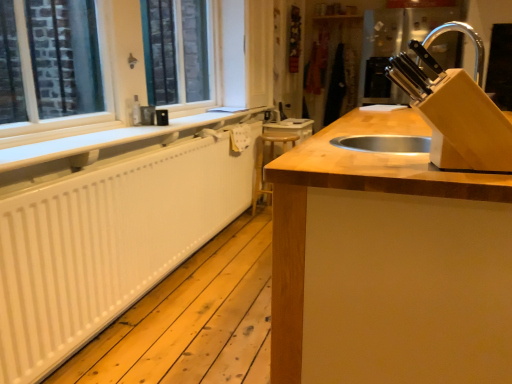
Question: In terms of size, does white matte radiator at left appear bigger or smaller than white painted wood at left?

Choices:
 (A) small
 (B) big

Answer: (A)

Question: From a real-world perspective, is white matte radiator at left physically located above or below white painted wood at left?

Choices:
 (A) below
 (B) above

Answer: (A)

Question: Which object is positioned closest to the white painted wood at left?

Choices:
 (A) white matte radiator at left
 (B) wooden at center
 (C) wooden at center
 (D) white matte radiator at left

Answer: (A)

Question: Which is farther from the wooden at center?

Choices:
 (A) wooden at center
 (B) white painted wood at left
 (C) white matte radiator at left
 (D) white matte radiator at left

Answer: (A)